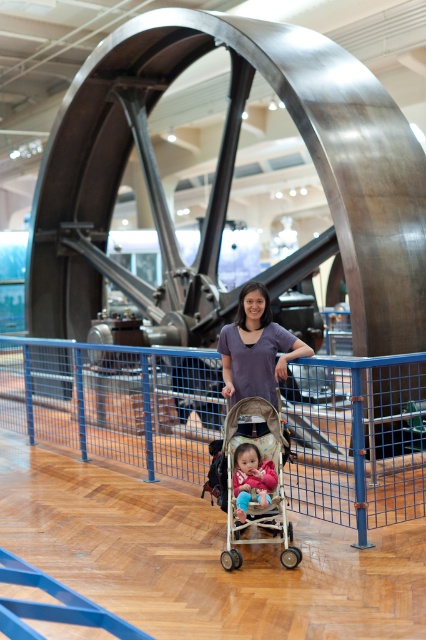
Question: Which of the following is the closest to the observer?

Choices:
 (A) pink fabric toddler at center
 (B) blue metal rail at center

Answer: (A)

Question: Which point is farther from the camera taking this photo?

Choices:
 (A) (5, 410)
 (B) (284, 493)
 (C) (270, 336)

Answer: (A)

Question: Which point is farther to the camera?

Choices:
 (A) (270, 467)
 (B) (190, 394)
 (C) (256, 324)

Answer: (B)

Question: Can you confirm if purple fabric shirt at center is positioned above pink fabric toddler at center?

Choices:
 (A) yes
 (B) no

Answer: (A)

Question: Is blue metal rail at center smaller than beige fabric stroller at center?

Choices:
 (A) no
 (B) yes

Answer: (B)

Question: In this image, where is blue metal rail at center located relative to beige fabric stroller at center?

Choices:
 (A) right
 (B) left

Answer: (B)